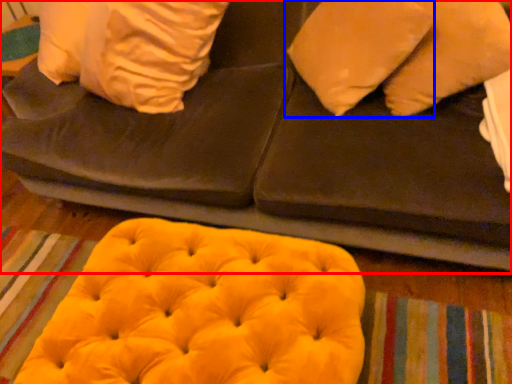
Question: Which point is closer to the camera, furniture (highlighted by a red box) or pillow (highlighted by a blue box)?

Choices:
 (A) furniture
 (B) pillow

Answer: (A)